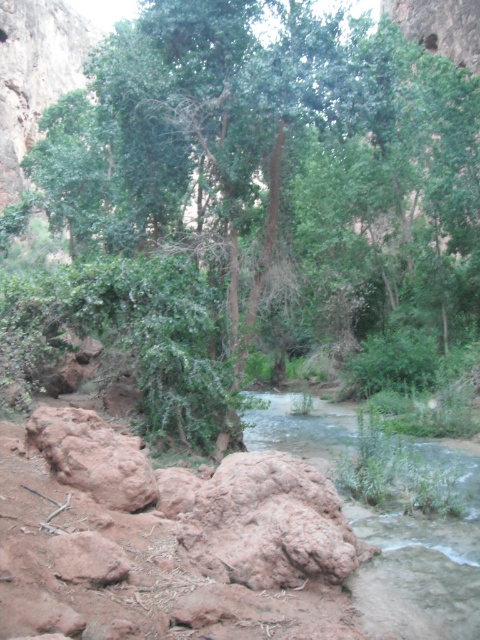
Question: Does green leafy tree at center have a larger size compared to clear water at center?

Choices:
 (A) yes
 (B) no

Answer: (A)

Question: Which point is closer to the camera taking this photo?

Choices:
 (A) (478, 563)
 (B) (317, 228)

Answer: (A)

Question: Is green leafy tree at center smaller than clear water at center?

Choices:
 (A) yes
 (B) no

Answer: (B)

Question: From the image, what is the correct spatial relationship of green leafy tree at center in relation to clear water at center?

Choices:
 (A) left
 (B) right

Answer: (A)

Question: Among these objects, which one is nearest to the camera?

Choices:
 (A) clear water at center
 (B) green leafy tree at center

Answer: (A)